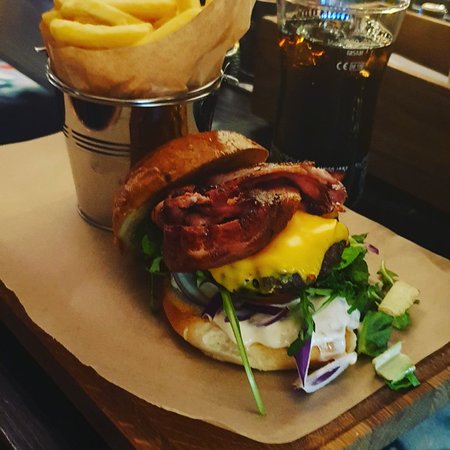
At what (x,y) coordinates should I click in order to perform the action: click on edge of table. Please return your answer as a coordinate pair (x, y). The height and width of the screenshot is (450, 450). Looking at the image, I should click on (392, 421).